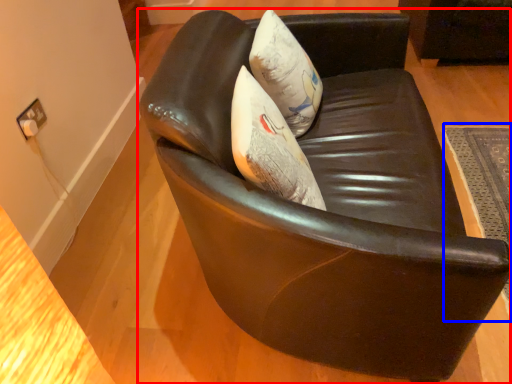
Question: Among these objects, which one is nearest to the camera, chair (highlighted by a red box) or mat (highlighted by a blue box)?

Choices:
 (A) chair
 (B) mat

Answer: (A)